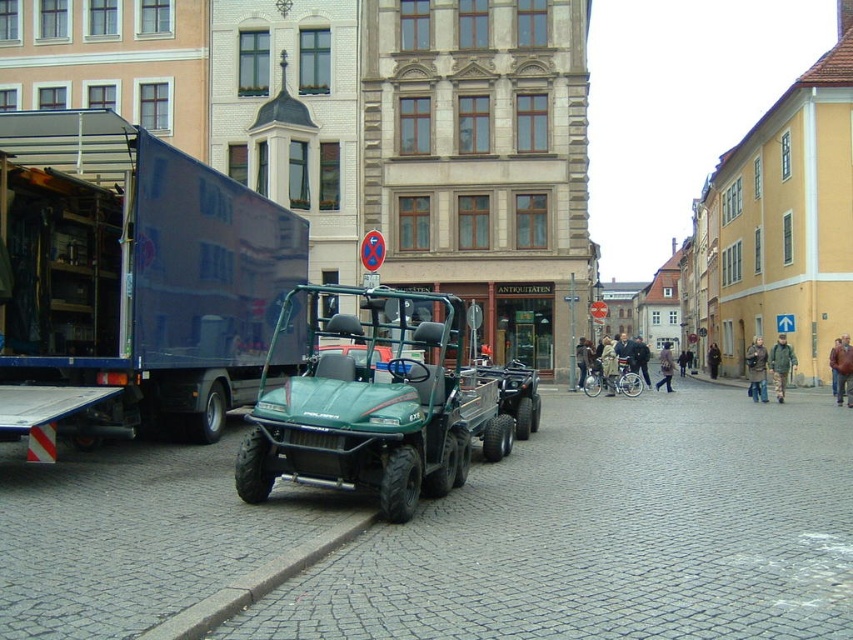
Question: Is blue metallic truck at left bigger than green matte utility vehicle at center?

Choices:
 (A) no
 (B) yes

Answer: (A)

Question: Is blue metallic truck at left to the right of green matte utility vehicle at center from the viewer's perspective?

Choices:
 (A) no
 (B) yes

Answer: (A)

Question: Which object is farther from the camera taking this photo?

Choices:
 (A) green matte utility vehicle at center
 (B) blue metallic truck at left

Answer: (B)

Question: Can you confirm if blue metallic truck at left is smaller than green matte utility vehicle at center?

Choices:
 (A) no
 (B) yes

Answer: (B)

Question: Which of the following is the farthest from the observer?

Choices:
 (A) green matte utility vehicle at center
 (B) blue metallic truck at left

Answer: (B)

Question: Which object appears closest to the camera in this image?

Choices:
 (A) blue metallic truck at left
 (B) green matte utility vehicle at center

Answer: (B)